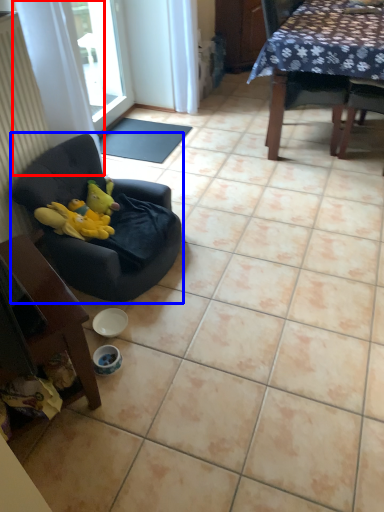
Question: Among these objects, which one is farthest to the camera, curtain (highlighted by a red box) or chair (highlighted by a blue box)?

Choices:
 (A) curtain
 (B) chair

Answer: (A)